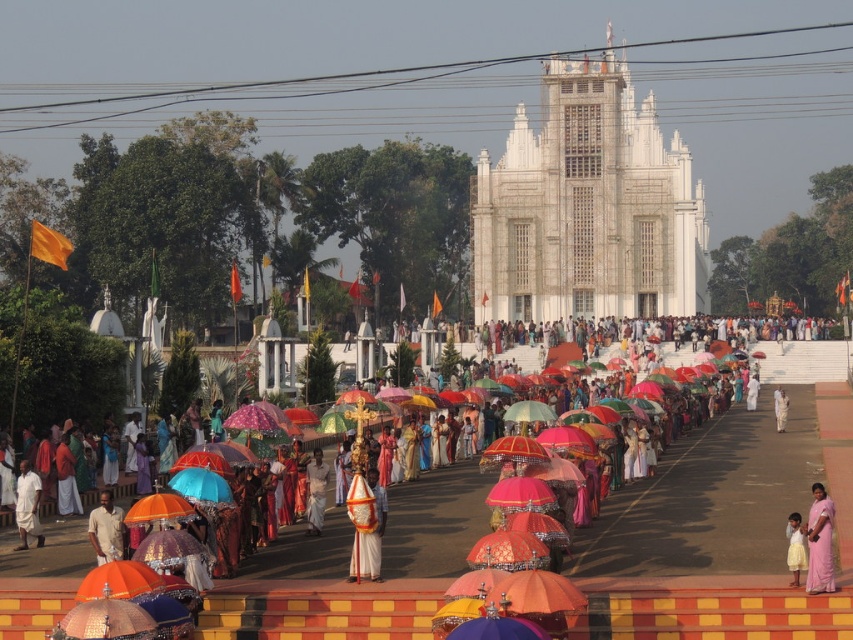
Who is more distant from viewer, [631,588] or [117,515]?

Point [117,515]

Which of these two, multicolored umbrellas at center or light beige cotton shirt at center, stands taller?

With more height is multicolored umbrellas at center.

Which is in front, point (616, 502) or point (106, 554)?

Point (106, 554) is more forward.

Identify the location of multicolored umbrellas at center. (709, 538).

Between white stone temple at center and pink silk saree at lower right, which one appears on the left side from the viewer's perspective?

white stone temple at center is more to the left.

Does white stone temple at center appear over pink silk saree at lower right?

Yes.

Is point (572, 166) positioned after point (798, 528)?

Yes, it is behind point (798, 528).

Find the location of a particular element. This screenshot has width=853, height=640. white stone temple at center is located at coordinates (587, 208).

Can you confirm if light beige cotton shirt at center is positioned above white cotton dhoti at center?

Incorrect, light beige cotton shirt at center is not positioned above white cotton dhoti at center.

Looking at this image, which is above, light beige cotton shirt at center or white cotton dhoti at center?

white cotton dhoti at center

Where is `light beige cotton shirt at center`? light beige cotton shirt at center is located at coordinates (106, 529).